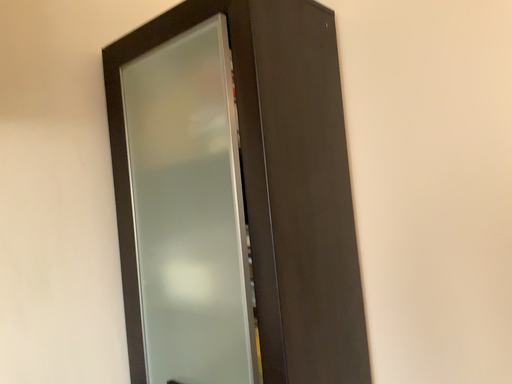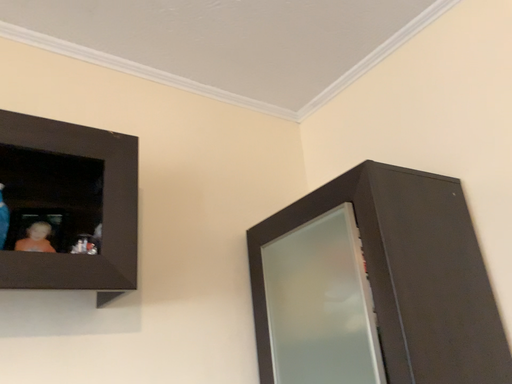
Question: How did the camera likely rotate when shooting the video?

Choices:
 (A) rotated upward
 (B) rotated downward

Answer: (A)